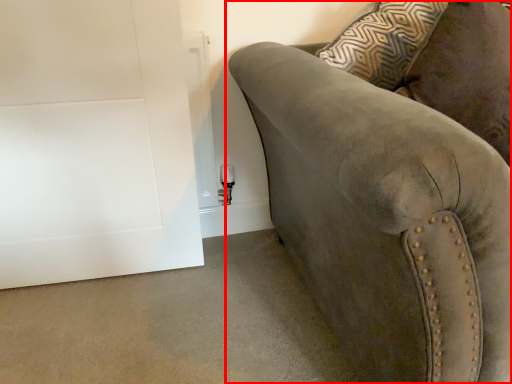
Question: Considering the relative positions of studio couch (annotated by the red box) and door in the image provided, where is studio couch (annotated by the red box) located with respect to the staircase?

Choices:
 (A) right
 (B) left

Answer: (A)